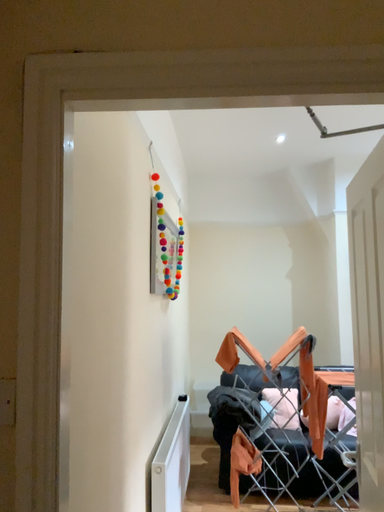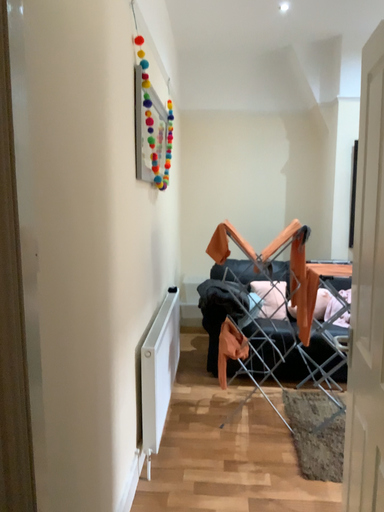
Question: How did the camera likely rotate when shooting the video?

Choices:
 (A) rotated upward
 (B) rotated downward

Answer: (B)